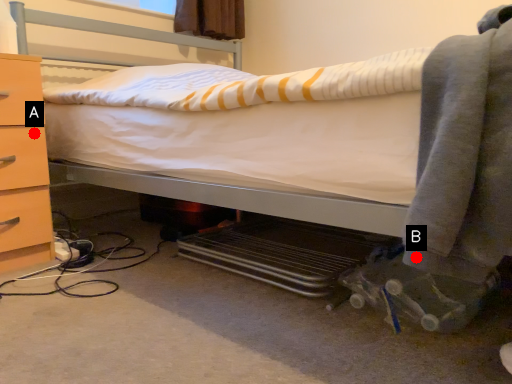
Question: Two points are circled on the image, labeled by A and B beside each circle. Which point is closer to the camera?

Choices:
 (A) A is closer
 (B) B is closer

Answer: (B)